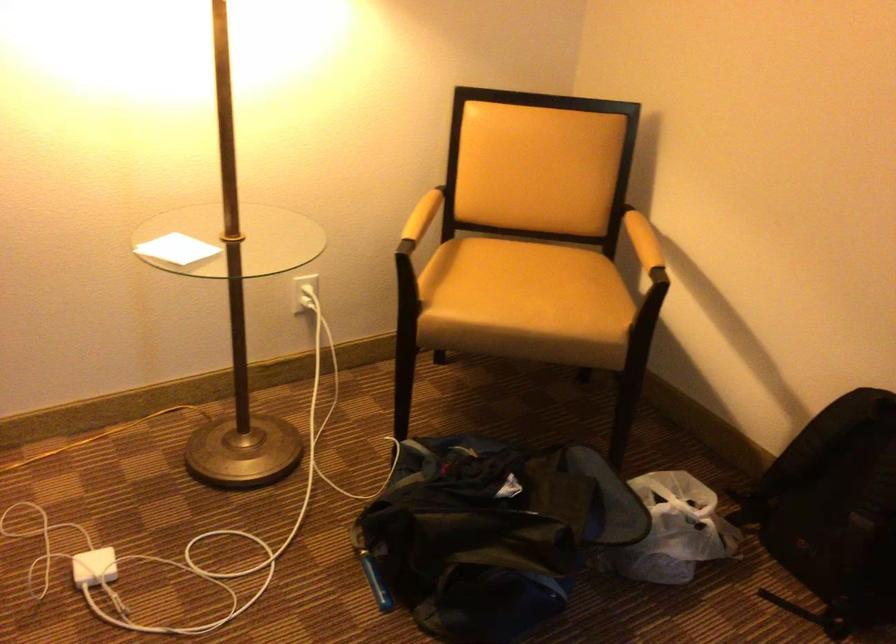
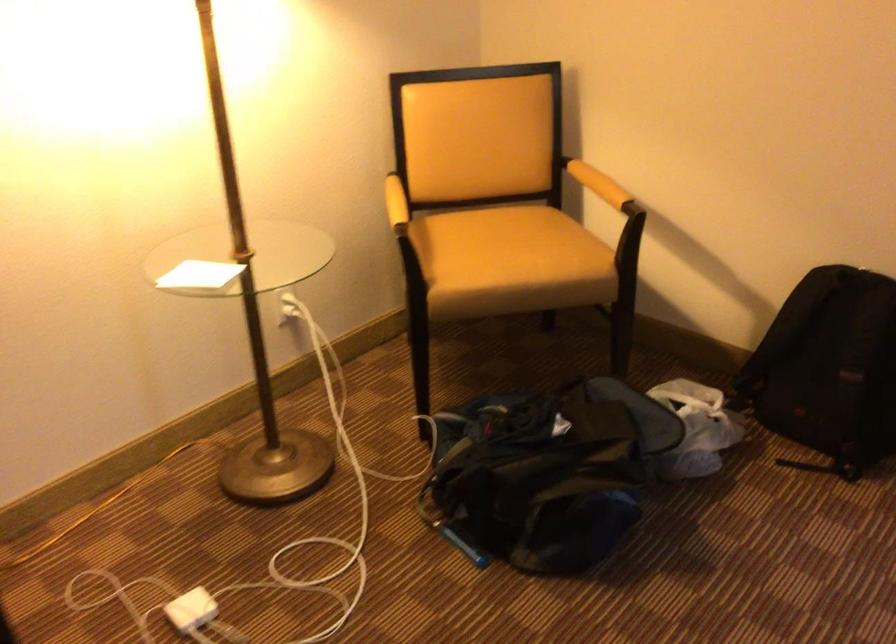
The point at [515,301] is marked in the first image. Where is the corresponding point in the second image?

(510, 261)